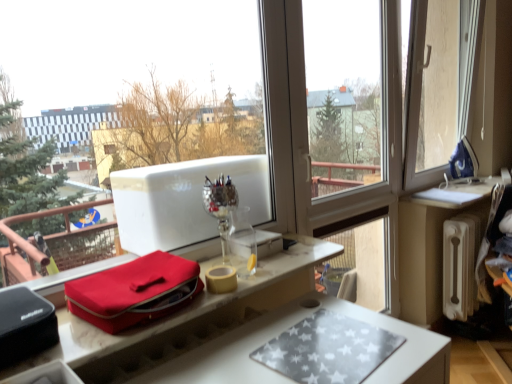
Question: Is white radiator at right not close to silver reflective wine glass at center?

Choices:
 (A) no
 (B) yes

Answer: (B)

Question: Does white radiator at right appear on the right side of silver reflective wine glass at center?

Choices:
 (A) yes
 (B) no

Answer: (A)

Question: Considering the relative sizes of white radiator at right and silver reflective wine glass at center in the image provided, is white radiator at right shorter than silver reflective wine glass at center?

Choices:
 (A) no
 (B) yes

Answer: (A)

Question: Is white radiator at right smaller than silver reflective wine glass at center?

Choices:
 (A) no
 (B) yes

Answer: (A)

Question: Considering the relative sizes of white radiator at right and silver reflective wine glass at center in the image provided, is white radiator at right bigger than silver reflective wine glass at center?

Choices:
 (A) no
 (B) yes

Answer: (B)

Question: Looking at their shapes, would you say matte red bag at center is wider or thinner than white radiator at right?

Choices:
 (A) thin
 (B) wide

Answer: (B)

Question: From a real-world perspective, is matte red bag at center above or below white radiator at right?

Choices:
 (A) below
 (B) above

Answer: (B)

Question: From the image's perspective, is matte red bag at center above or below white radiator at right?

Choices:
 (A) above
 (B) below

Answer: (A)

Question: From their relative heights in the image, would you say matte red bag at center is taller or shorter than white radiator at right?

Choices:
 (A) short
 (B) tall

Answer: (A)

Question: Based on their sizes in the image, would you say matte red bag at center is bigger or smaller than matte red bag at center?

Choices:
 (A) small
 (B) big

Answer: (B)

Question: Considering the positions of matte red bag at center and matte red bag at center in the image, is matte red bag at center taller or shorter than matte red bag at center?

Choices:
 (A) short
 (B) tall

Answer: (A)

Question: Considering the positions of point (278, 291) and point (146, 292), is point (278, 291) closer or farther from the camera than point (146, 292)?

Choices:
 (A) closer
 (B) farther

Answer: (B)

Question: Is matte red bag at center inside or outside of matte red bag at center?

Choices:
 (A) inside
 (B) outside

Answer: (B)

Question: From a real-world perspective, is blue fabric iron at upper right physically located above or below matte red bag at center?

Choices:
 (A) below
 (B) above

Answer: (B)

Question: Is blue fabric iron at upper right in front of or behind matte red bag at center in the image?

Choices:
 (A) behind
 (B) front

Answer: (A)